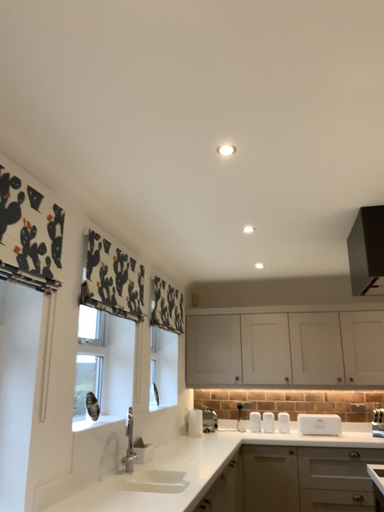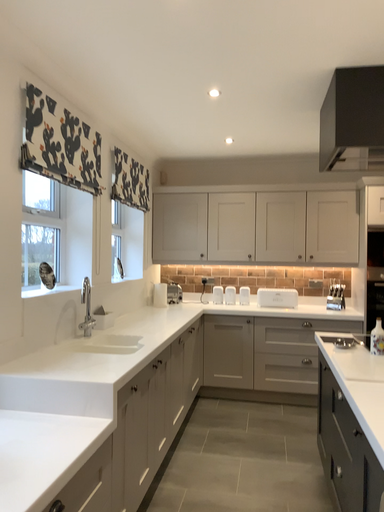
Question: Which way did the camera rotate in the video?

Choices:
 (A) rotated upward
 (B) rotated downward

Answer: (B)